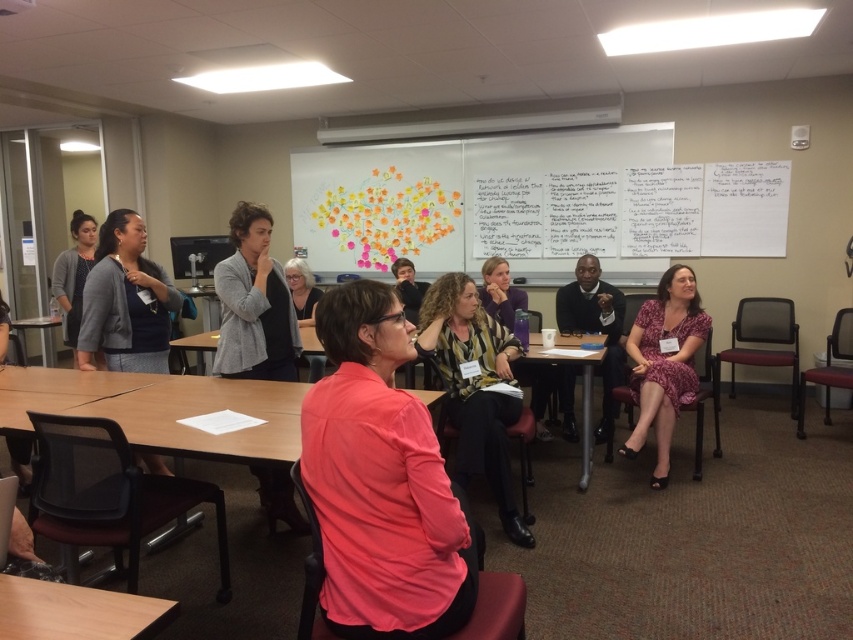
Is point (662, 292) positioned before point (294, 264)?

Yes, point (662, 292) is closer to viewer.

Does purple floral dress at lower right appear under white matte hair at center?

Yes, purple floral dress at lower right is below white matte hair at center.

Is point (631, 442) closer to viewer compared to point (288, 273)?

Yes, point (631, 442) is in front of point (288, 273).

Identify the location of purple floral dress at lower right. This screenshot has height=640, width=853. (664, 362).

Who is positioned more to the left, purple floral dress at lower right or wooden table at lower left?

Positioned to the left is wooden table at lower left.

Is point (633, 369) less distant than point (12, 602)?

No, (633, 369) is further to viewer.

Who is more distant from viewer, (x=643, y=317) or (x=4, y=618)?

Positioned behind is point (x=643, y=317).

Where is `purple floral dress at lower right`? Image resolution: width=853 pixels, height=640 pixels. purple floral dress at lower right is located at coordinates (664, 362).

Consider the image. Can you confirm if patterned fabric blouse at center is bigger than matte gray cardigan at left?

No, patterned fabric blouse at center is not bigger than matte gray cardigan at left.

Can you confirm if patterned fabric blouse at center is positioned to the left of matte gray cardigan at left?

Incorrect, patterned fabric blouse at center is not on the left side of matte gray cardigan at left.

Who is more forward, (456,419) or (68,323)?

Point (456,419) is more forward.

The height and width of the screenshot is (640, 853). Identify the location of patterned fabric blouse at center. (474, 387).